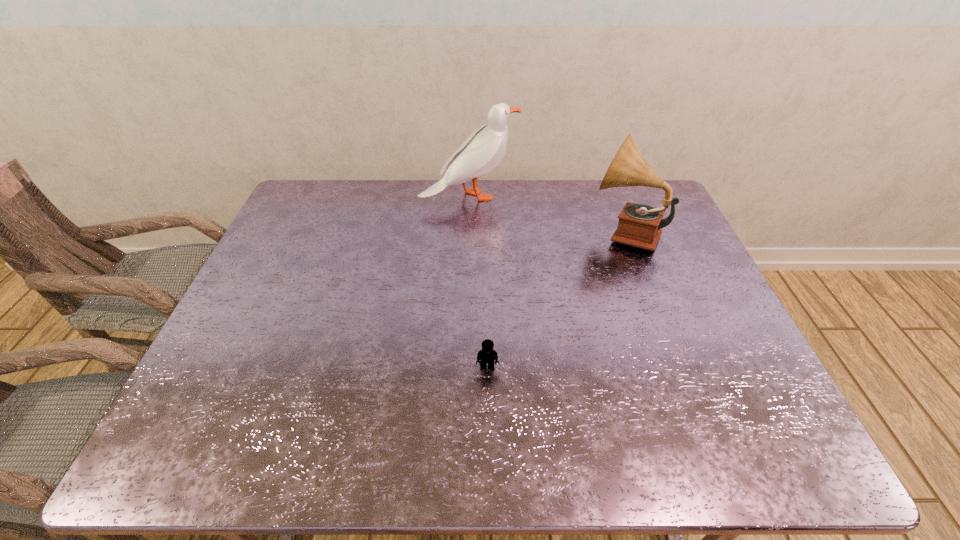
The height and width of the screenshot is (540, 960). I want to click on gull, so [x=483, y=150].

Where is `phonograph record`? This screenshot has width=960, height=540. phonograph record is located at coordinates (639, 225).

Locate an element on the screen. This screenshot has height=540, width=960. the shortest object is located at coordinates (487, 355).

You are a GUI agent. You are given a task and a screenshot of the screen. Output one action in this format:
    pyautogui.click(x=<x>, y=<y>)
    Task: Click on the Lego
    This screenshot has height=540, width=960.
    Given the screenshot: What is the action you would take?
    pyautogui.click(x=487, y=355)

The image size is (960, 540). What are the coordinates of `free space located at the beak of the gull` in the screenshot? It's located at (618, 196).

The width and height of the screenshot is (960, 540). Find the location of `vacant space positioned on the horn of the phonograph record`. vacant space positioned on the horn of the phonograph record is located at coordinates (535, 232).

The image size is (960, 540). Find the location of `blank space located on the horn of the phonograph record`. blank space located on the horn of the phonograph record is located at coordinates (493, 232).

In order to click on free space located 0.160m on the horn of the phonograph record in this screenshot , I will do `click(538, 232)`.

This screenshot has width=960, height=540. I want to click on vacant area situated 0.170m on the front-facing side of the shortest object, so click(489, 446).

This screenshot has width=960, height=540. Identify the location of gull that is at the far edge. (483, 150).